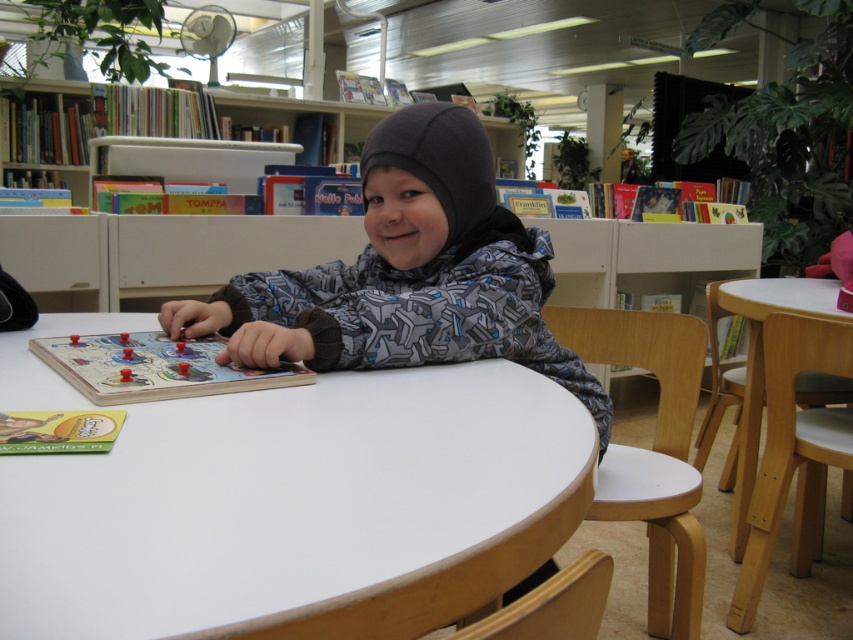
Can you confirm if wooden board game at center is taller than wooden table at lower right?

Incorrect, wooden board game at center's height is not larger of wooden table at lower right's.

Is wooden board game at center below wooden table at lower right?

No.

Does point (152, 358) come closer to viewer compared to point (737, 451)?

Yes, point (152, 358) is closer to viewer.

The image size is (853, 640). I want to click on wooden board game at center, so click(154, 368).

Find the location of a particular element. This screenshot has height=640, width=853. gray fleece jacket at center is located at coordinates (408, 273).

Is point (550, 291) farther from viewer compared to point (97, 387)?

Yes.

I want to click on gray fleece jacket at center, so click(408, 273).

Does white plastic bookshelf at upper center have a lesser height compared to wooden board game at center?

In fact, white plastic bookshelf at upper center may be taller than wooden board game at center.

Who is shorter, white plastic bookshelf at upper center or wooden board game at center?

With less height is wooden board game at center.

Is point (57, 236) closer to viewer compared to point (128, 394)?

No, it is behind (128, 394).

This screenshot has width=853, height=640. Find the location of `white plastic bookshelf at upper center`. white plastic bookshelf at upper center is located at coordinates (158, 256).